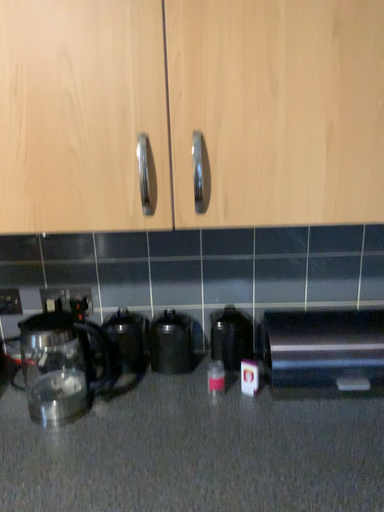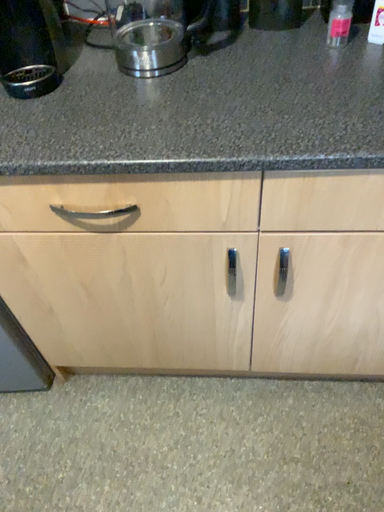
Question: Which way did the camera rotate in the video?

Choices:
 (A) rotated upward
 (B) rotated downward

Answer: (B)